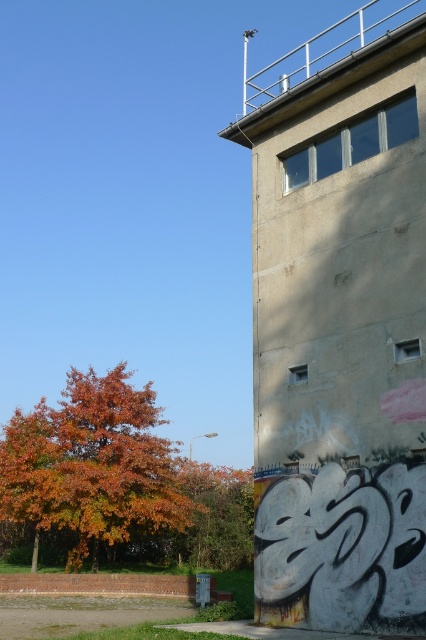
Question: Is orange leafy tree at lower left closer to the viewer compared to orange leafy tree at left?

Choices:
 (A) no
 (B) yes

Answer: (B)

Question: Among these objects, which one is nearest to the camera?

Choices:
 (A) orange leafy tree at left
 (B) orange leafy tree at lower left

Answer: (B)

Question: Which of the following is the closest to the observer?

Choices:
 (A) (68, 492)
 (B) (213, 474)

Answer: (A)

Question: Is orange leafy tree at lower left bigger than orange leafy tree at left?

Choices:
 (A) yes
 (B) no

Answer: (A)

Question: Does orange leafy tree at lower left have a greater width compared to orange leafy tree at left?

Choices:
 (A) no
 (B) yes

Answer: (B)